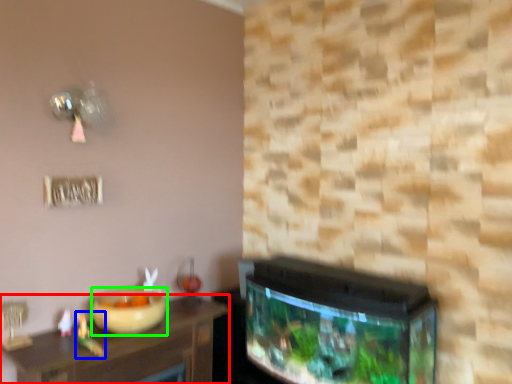
Question: Which object is positioned closest to table (highlighted by a red box)? Select from toy (highlighted by a blue box) and bowl (highlighted by a green box).

Choices:
 (A) toy
 (B) bowl

Answer: (B)